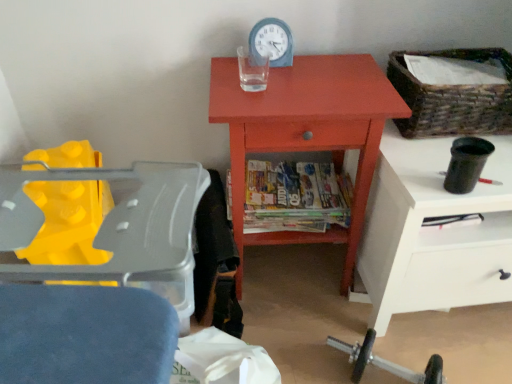
What are the coordinates of `free space above multicolored glossy magazines at center (from a real-world perspective)` in the screenshot? It's located at (281, 181).